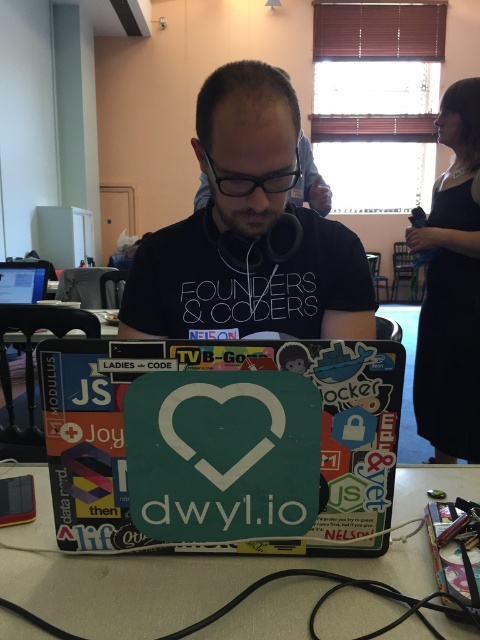
Does point (444, 125) come closer to viewer compared to point (21, 285)?

That is True.

Image resolution: width=480 pixels, height=640 pixels. What do you see at coordinates (452, 289) in the screenshot?
I see `black dress at right` at bounding box center [452, 289].

Locate an element on the screen. black dress at right is located at coordinates (452, 289).

Is the position of matte black table at lower center less distant than that of matte black laptop at left?

Yes, it is in front of matte black laptop at left.

Which is more to the right, matte black table at lower center or matte black laptop at left?

matte black table at lower center is more to the right.

Is point (4, 548) positioned in front of point (0, 291)?

Yes.

Where is `matte black table at lower center`? This screenshot has height=640, width=480. matte black table at lower center is located at coordinates (175, 584).

Looking at this image, is matte black table at lower center above black dress at right?

No.

Locate an element on the screen. matte black table at lower center is located at coordinates (175, 584).